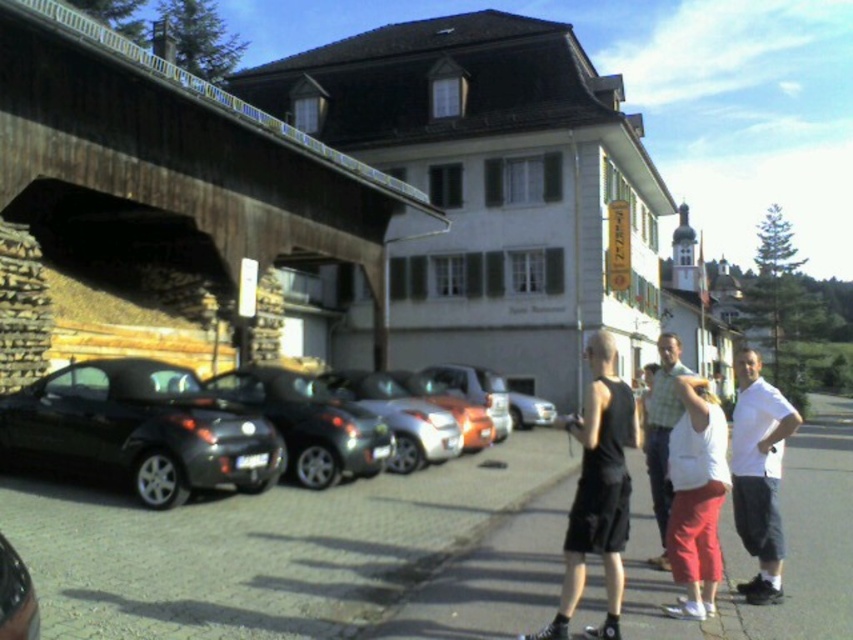
Does smooth concrete sidewalk at center appear on the left side of black matte skateboard at center?

In fact, smooth concrete sidewalk at center is to the right of black matte skateboard at center.

Where is `smooth concrete sidewalk at center`? The image size is (853, 640). smooth concrete sidewalk at center is located at coordinates (752, 561).

This screenshot has height=640, width=853. Find the location of `smooth concrete sidewalk at center`. smooth concrete sidewalk at center is located at coordinates (752, 561).

Is wooden bridge at upper left wider than smooth concrete sidewalk at center?

No.

Which is behind, point (123, 193) or point (720, 609)?

The point (123, 193) is behind.

Identify the location of wooden bridge at upper left. The height and width of the screenshot is (640, 853). (175, 166).

Who is more forward, (799, 518) or (775, 586)?

Positioned in front is point (775, 586).

Locate an element on the screen. This screenshot has height=640, width=853. smooth concrete sidewalk at center is located at coordinates (752, 561).